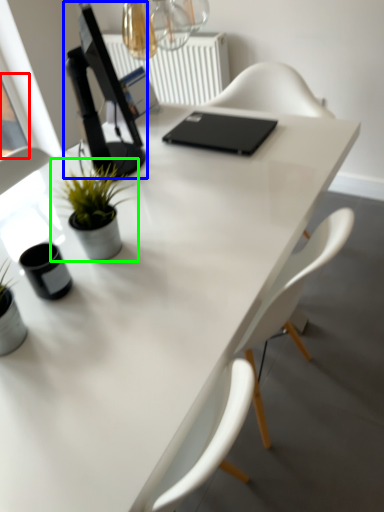
Question: Which object is positioned closest to window screen (highlighted by a red box)? Select from computer monitor (highlighted by a blue box) and houseplant (highlighted by a green box).

Choices:
 (A) computer monitor
 (B) houseplant

Answer: (A)